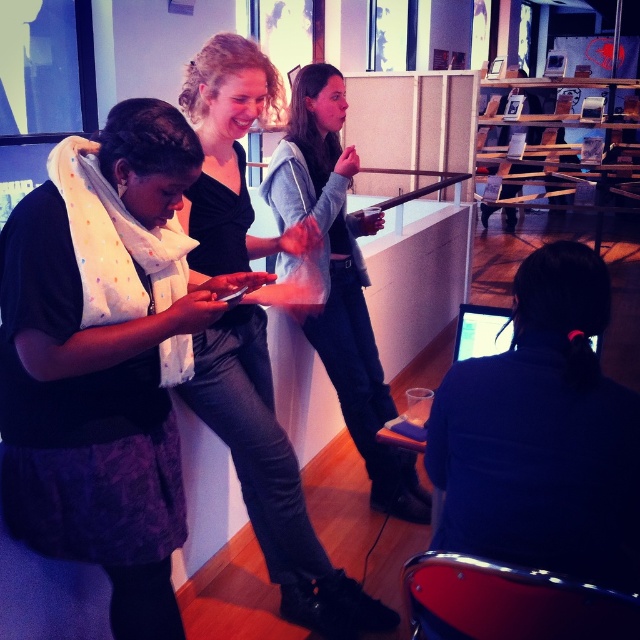
Question: Is matte black scarf at left positioned at the back of light gray sweater at center?

Choices:
 (A) no
 (B) yes

Answer: (A)

Question: Which of the following is the closest to the observer?

Choices:
 (A) light gray sweater at center
 (B) matte black sweater at upper center

Answer: (B)

Question: Does matte black sweater at upper center appear on the right side of light gray sweater at center?

Choices:
 (A) no
 (B) yes

Answer: (A)

Question: Among these points, which one is nearest to the camera?

Choices:
 (A) (291, 205)
 (B) (65, 291)
 (C) (269, 362)

Answer: (B)

Question: Can you confirm if matte black scarf at left is positioned above light gray sweater at center?

Choices:
 (A) no
 (B) yes

Answer: (A)

Question: Which of these objects is positioned closest to the matte black scarf at left?

Choices:
 (A) matte black sweater at upper center
 (B) light gray sweater at center

Answer: (A)